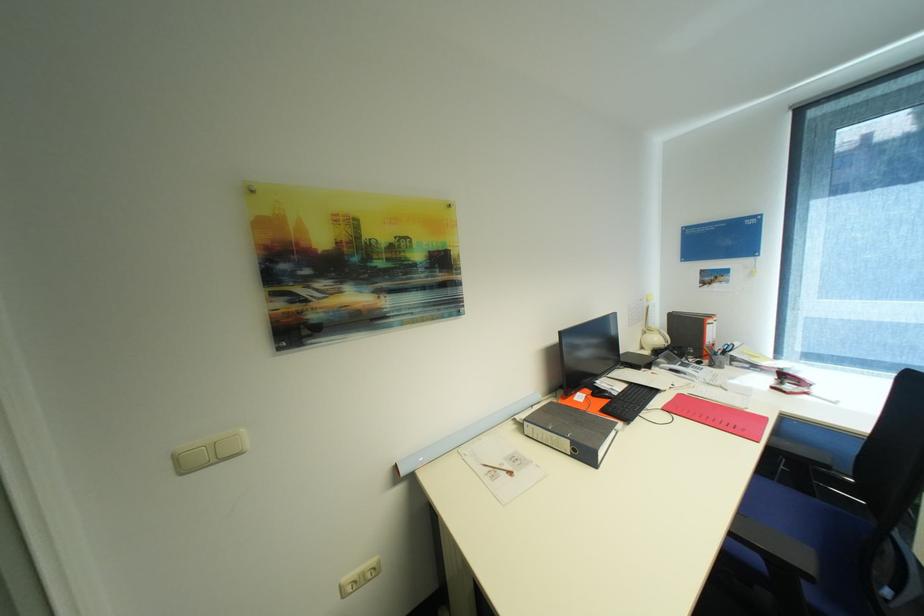
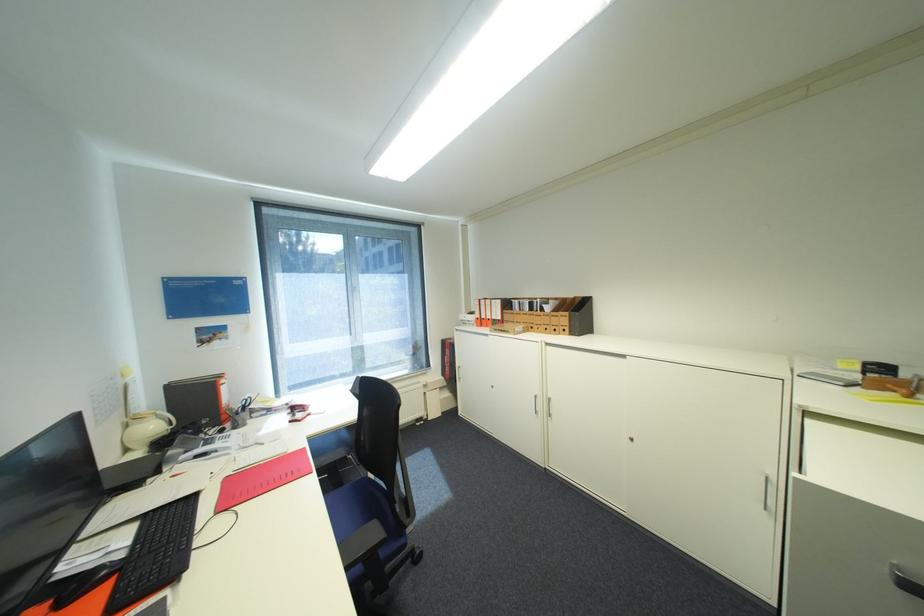
Question: The images are taken continuously from a first-person perspective. In which direction is your viewpoint rotating?

Choices:
 (A) Left
 (B) Right
 (C) Up
 (D) Down

Answer: (B)